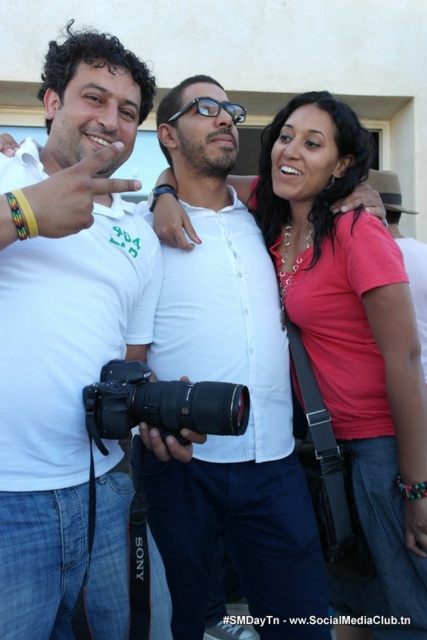
You are organizing a clothing donation drive and need to categorize shirts by size. Given that the white matte shirt at center is narrower than the matte pink shirt at center, which shirt would you place in the smaller size bin?

The white matte shirt at center is narrower than the matte pink shirt at center, so it should be placed in the smaller size bin.

Looking at this image, you are a photographer trying to capture a candid shot of the matte pink shirt at center and the black plastic camera at center. Since you want to ensure both are clearly visible, which object should you focus on first to account for their size difference?

The matte pink shirt at center has a larger size compared to the black plastic camera at center, so you should focus on the matte pink shirt at center first to ensure it is in sharp focus before adjusting for the smaller camera.